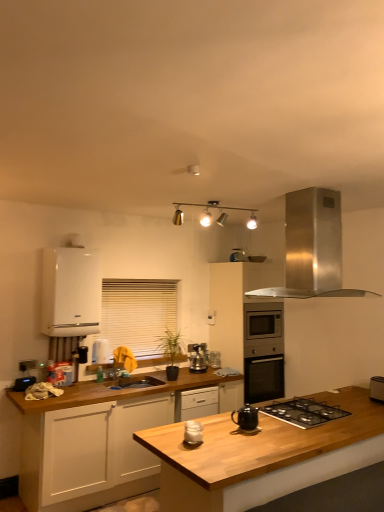
Question: Which direction should I rotate to look at satin silver kettle at center, marked as the 1th kitchen appliance in a back-to-front arrangement, — up or down?

Choices:
 (A) down
 (B) up

Answer: (A)

Question: Which direction should I rotate to look at stainless steel oven at center, positioned as the 3th cabinetry in left-to-right order, — up or down?

Choices:
 (A) down
 (B) up

Answer: (A)

Question: From the image's perspective, is white matte jar at center, which is the first kitchen appliance in front-to-back order, located above metallic track lighting at upper center?

Choices:
 (A) yes
 (B) no

Answer: (B)

Question: Is white matte jar at center, which is the first kitchen appliance in front-to-back order, smaller than metallic track lighting at upper center?

Choices:
 (A) yes
 (B) no

Answer: (A)

Question: Would you say white matte jar at center, which is the first kitchen appliance in front-to-back order, is outside metallic track lighting at upper center?

Choices:
 (A) no
 (B) yes

Answer: (B)

Question: Is white matte jar at center, acting as the 3th kitchen appliance starting from the back, not close to metallic track lighting at upper center?

Choices:
 (A) no
 (B) yes

Answer: (B)

Question: Is metallic track lighting at upper center a part of white matte jar at center, which is the first kitchen appliance in front-to-back order?

Choices:
 (A) no
 (B) yes

Answer: (A)

Question: Could you tell me if white matte jar at center, acting as the 3th kitchen appliance starting from the back, is facing metallic track lighting at upper center?

Choices:
 (A) yes
 (B) no

Answer: (B)

Question: From the image's perspective, is black matte teapot at center, the 2th kitchen appliance viewed from the front, below white matte jar at center, acting as the 3th kitchen appliance starting from the back?

Choices:
 (A) yes
 (B) no

Answer: (B)

Question: Considering the relative sizes of black matte teapot at center, acting as the second kitchen appliance starting from the back, and white matte jar at center, which is the first kitchen appliance in front-to-back order, in the image provided, is black matte teapot at center, acting as the second kitchen appliance starting from the back, wider than white matte jar at center, which is the first kitchen appliance in front-to-back order,?

Choices:
 (A) yes
 (B) no

Answer: (A)

Question: Is black matte teapot at center, acting as the second kitchen appliance starting from the back, not near white matte jar at center, which is the first kitchen appliance in front-to-back order?

Choices:
 (A) no
 (B) yes

Answer: (A)

Question: Is black matte teapot at center, acting as the second kitchen appliance starting from the back, to the left of white matte jar at center, acting as the 3th kitchen appliance starting from the back, from the viewer's perspective?

Choices:
 (A) no
 (B) yes

Answer: (A)

Question: Is black matte teapot at center, the 2th kitchen appliance viewed from the front, oriented away from white matte jar at center, acting as the 3th kitchen appliance starting from the back?

Choices:
 (A) no
 (B) yes

Answer: (A)

Question: From the image's perspective, is black matte teapot at center, acting as the second kitchen appliance starting from the back, over white matte jar at center, acting as the 3th kitchen appliance starting from the back?

Choices:
 (A) yes
 (B) no

Answer: (A)

Question: Is wooden at center next to white blinds at center?

Choices:
 (A) no
 (B) yes

Answer: (A)